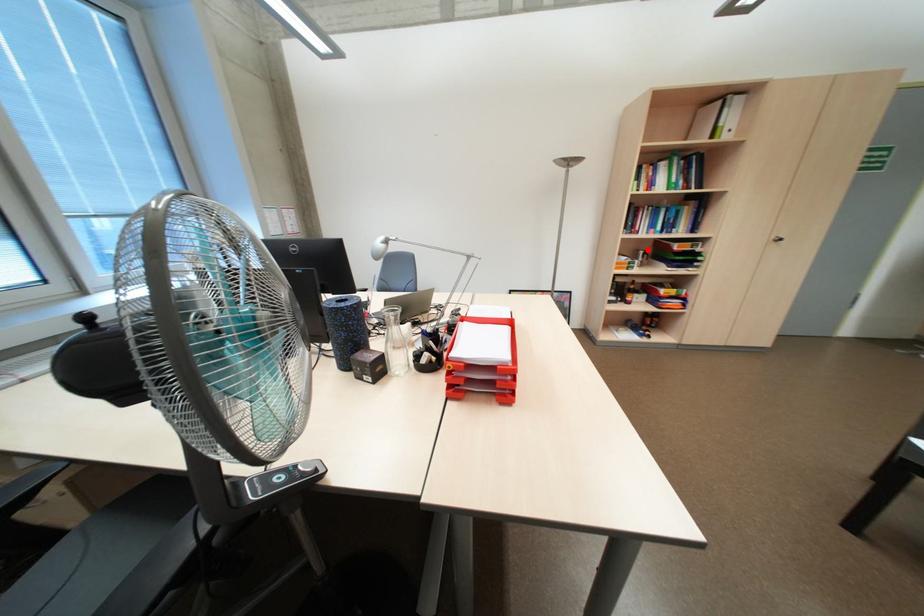
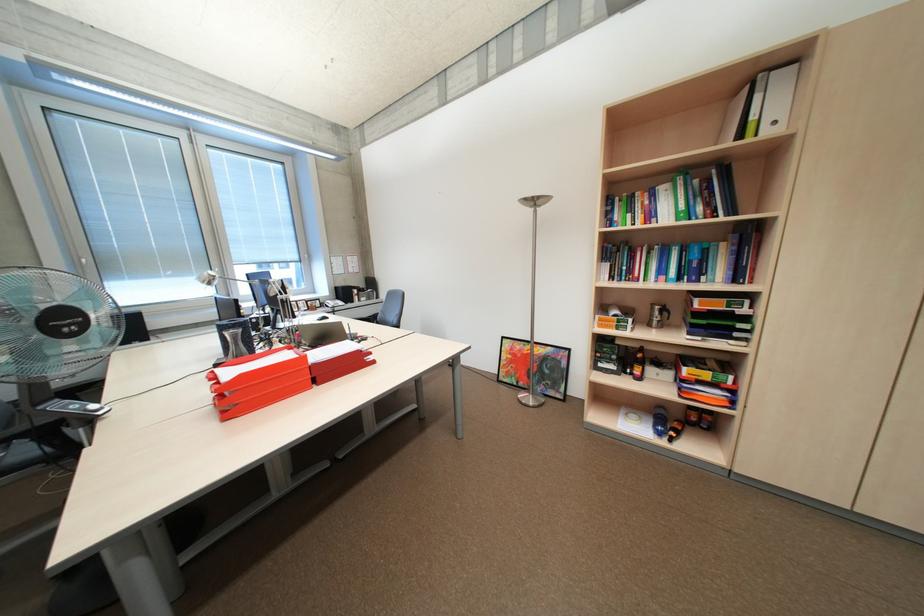
Locate, in the second image, the point that corresponds to the highlighted location in the first image.

(663, 304)